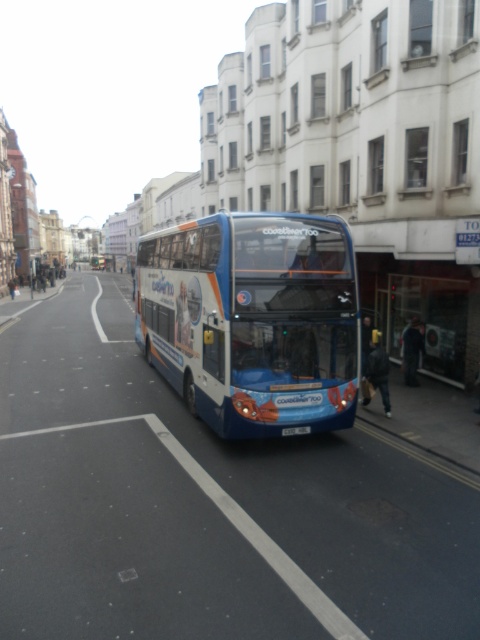
You are standing at point [252,321] in the urban street scene. What object is located exactly at your current position?

The blue matte decorative bus at center is located exactly at point [252,321].